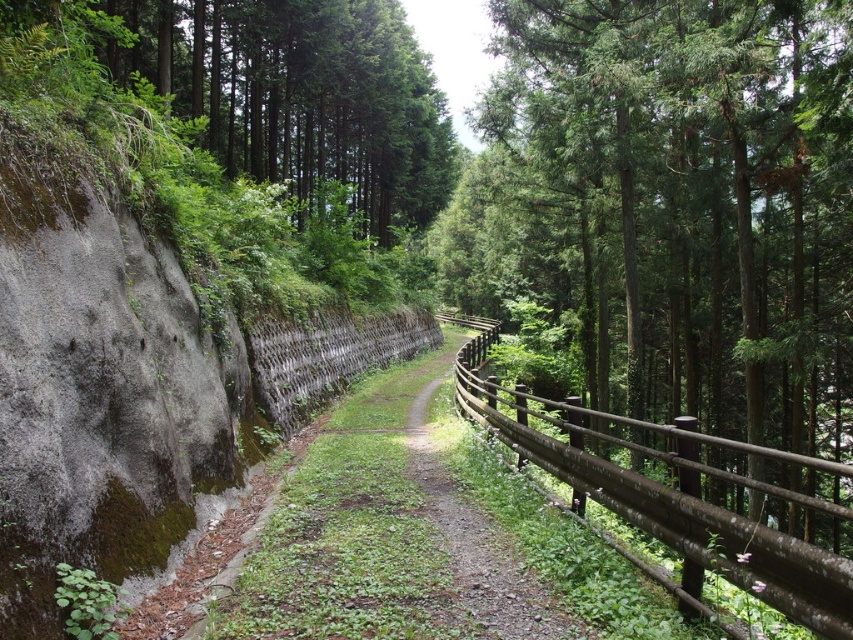
You are planning to install a new fence along the path in the forest. You have two options available from the image, the green textured fence at right and the brown wooden fence at right. Which fence would you choose if you want the one that is larger in size?

The green textured fence at right is bigger than the brown wooden fence at right, so you should choose the green textured fence at right if you want the larger one.

You are a hiker walking along the forest path and notice two fences on your right side. The green textured fence at right and the brown wooden fence at right. Which one is positioned higher up relative to the other?

The green textured fence at right is positioned higher up than the brown wooden fence at right because it is located above it.

You are a hiker walking along the forest path and need to decide whether to take a break on the brown wooden trail at center or rest against the brown wooden fence at right. Considering their sizes, which one would provide more space for sitting?

The brown wooden fence at right has a larger size compared to the brown wooden trail at center, so it would provide more space for sitting.